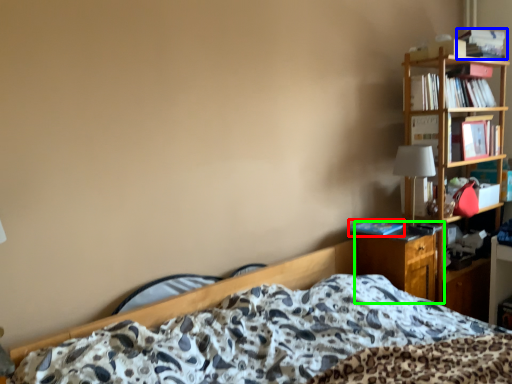
Question: Estimate the real-world distances between objects in this image. Which object is closer to book (highlighted by a red box), book (highlighted by a blue box) or nightstand (highlighted by a green box)?

Choices:
 (A) book
 (B) nightstand

Answer: (B)